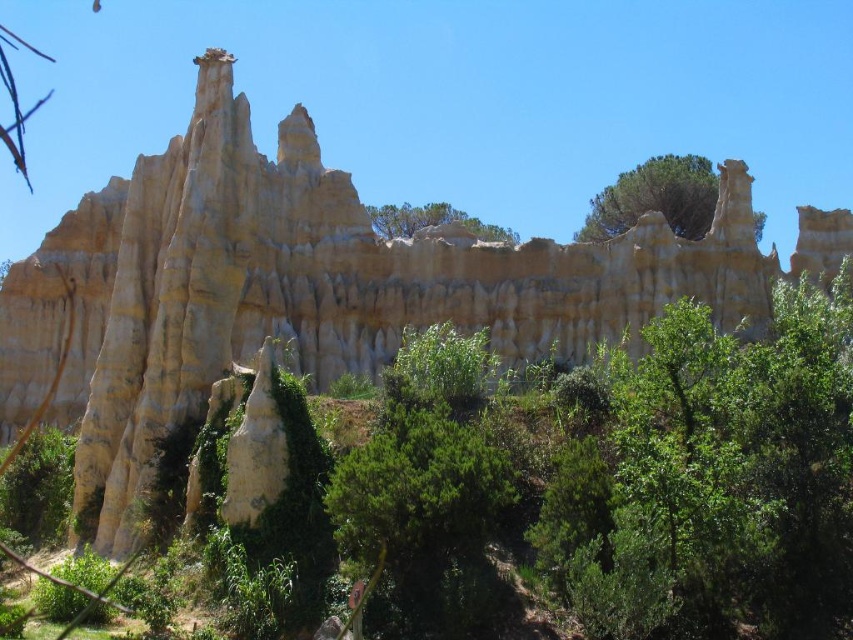
Between point (698, 225) and point (497, 241), which one is positioned in front?

Point (698, 225) is in front.

Find the location of a particular element. The width and height of the screenshot is (853, 640). green leafy tree at upper center is located at coordinates (654, 196).

Is point (680, 163) farther from camera compared to point (498, 228)?

No.

I want to click on green leafy tree at upper center, so click(654, 196).